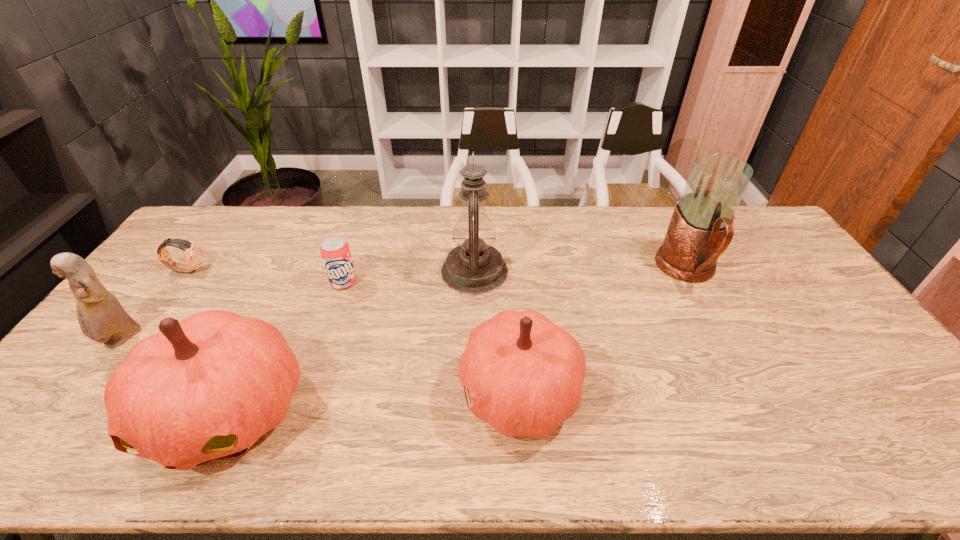
This screenshot has height=540, width=960. I want to click on free point located 0.160m on the face of the shortest object, so click(254, 270).

Image resolution: width=960 pixels, height=540 pixels. In order to click on vacant position located with the handle on the side of the pitcher in this screenshot , I will do `click(721, 333)`.

Identify the location of free space located on the surface of the sixth tallest object. Image resolution: width=960 pixels, height=540 pixels. (332, 318).

Locate an element on the screen. This screenshot has width=960, height=540. free region located on the front-facing side of the figurine is located at coordinates (61, 416).

Locate an element on the screen. The image size is (960, 540). blank space located 0.140m on the left of the oil lamp is located at coordinates (397, 271).

Locate an element on the screen. watch that is positioned at the left edge is located at coordinates (194, 254).

At what (x,y) coordinates should I click in order to perform the action: click on figurine that is at the left edge. Please return your answer as a coordinate pair (x, y). Looking at the image, I should click on (101, 317).

This screenshot has height=540, width=960. In order to click on blank area at the far edge in this screenshot , I will do `click(526, 239)`.

In the image, there is a desktop. Where is `vacant space at the left edge`? This screenshot has height=540, width=960. vacant space at the left edge is located at coordinates (150, 316).

Where is `free space at the right edge`? This screenshot has width=960, height=540. free space at the right edge is located at coordinates (859, 382).